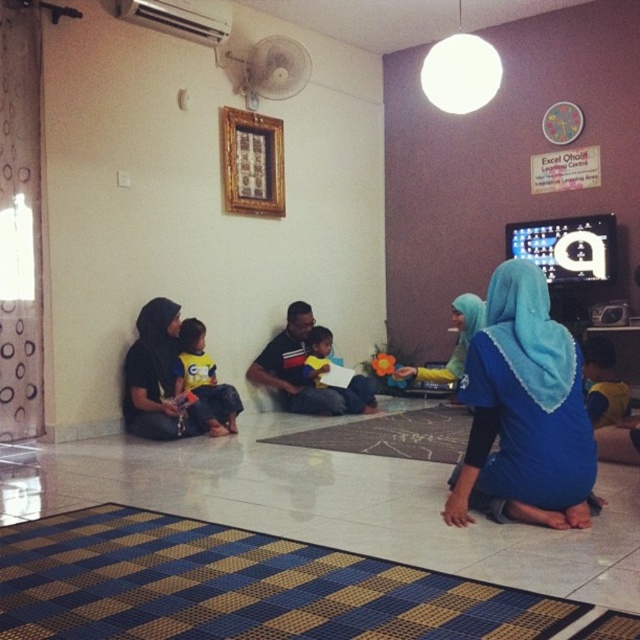
You are a delivery person who needs to place a small package between the matte black hijab at left and the white textured mat at center. The package is 4 feet long. Can you fit it in the space between them without moving the objects?

The distance between the matte black hijab at left and the white textured mat at center is 3.43 feet, which is shorter than the 4 feet length of the package. Therefore, the package cannot be placed between them without moving the objects.

You are standing in the living room and want to place a small decorative item exactly at the center of the room. The center is marked at coordinate point 0.5, 0.5. Is the matte black hijab at left closer to the center than 0.1 units?

The position of matte black hijab at left is at point (161, 380). The distance to the center point (320, 320) can be calculated using the Euclidean distance formula. The horizontal difference is 0.095 and the vertical difference is 0.248. The squared differences are 0.0089 and 0.0615, summing to 0.0704. The square root of this is approximately 0.265, which is greater than 0.1 units. Therefore, the matte black hijab at left is not closer to the center than 0.1 units.

Looking at this image, you are a photographer taking a picture of the yellow jersey at left and the yellow fabric shirt at center. Which object should you focus on first if you want to capture both in the frame without moving the camera?

You should focus on the yellow jersey at left first because it is positioned to the left of the yellow fabric shirt at center, so capturing it first ensures both are in the frame without needing to adjust the camera position.